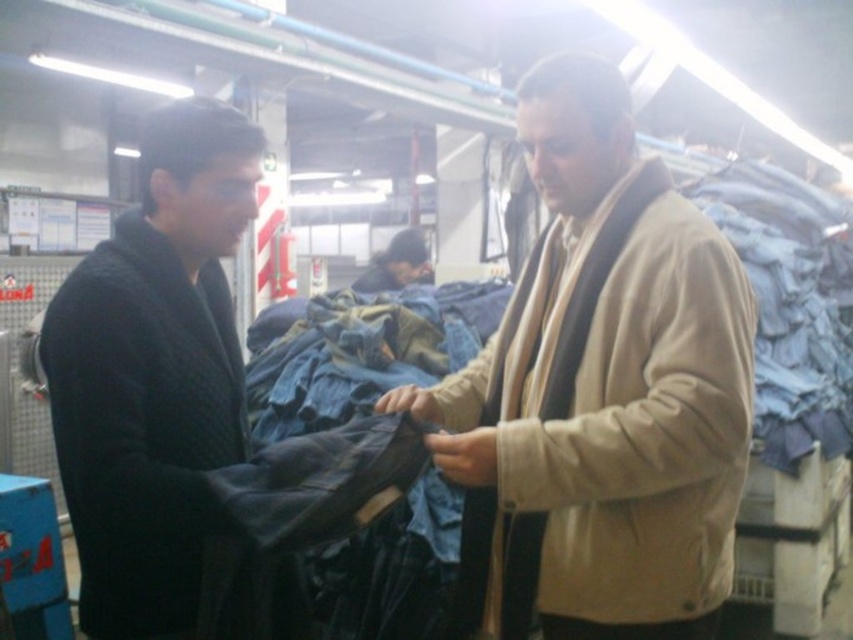
Question: Which point is farther to the camera?

Choices:
 (A) (44, 360)
 (B) (402, 280)

Answer: (B)

Question: Does black woolen sweater at left appear on the right side of dark blue denim jacket at center?

Choices:
 (A) yes
 (B) no

Answer: (B)

Question: Is beige fabric jacket at center below dark blue denim jacket at center?

Choices:
 (A) yes
 (B) no

Answer: (A)

Question: Which object is positioned farthest from the beige fabric jacket at center?

Choices:
 (A) black woolen sweater at left
 (B) dark blue denim jacket at center

Answer: (B)

Question: Does beige fabric jacket at center come behind black woolen sweater at left?

Choices:
 (A) no
 (B) yes

Answer: (B)

Question: Which point is closer to the camera?

Choices:
 (A) black woolen sweater at left
 (B) beige fabric jacket at center
 (C) dark blue denim jacket at center

Answer: (A)